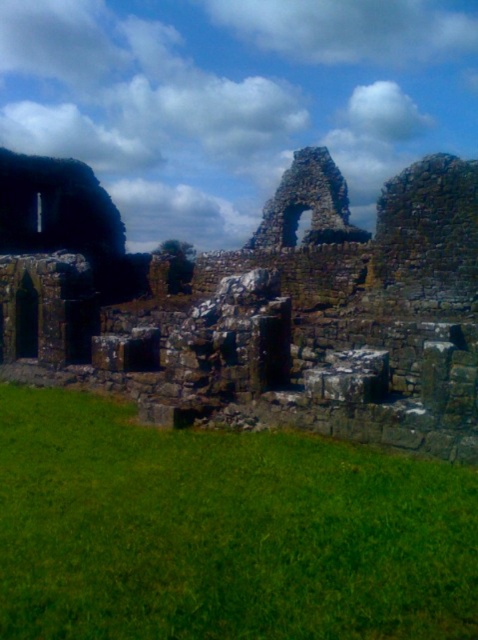
Consider the image. Is green grass at lower center smaller than rusty stone ruins at left?

Indeed, green grass at lower center has a smaller size compared to rusty stone ruins at left.

Does point (32, 595) lie behind point (310, 333)?

No.

Where is `green grass at lower center`? This screenshot has width=478, height=640. green grass at lower center is located at coordinates (223, 531).